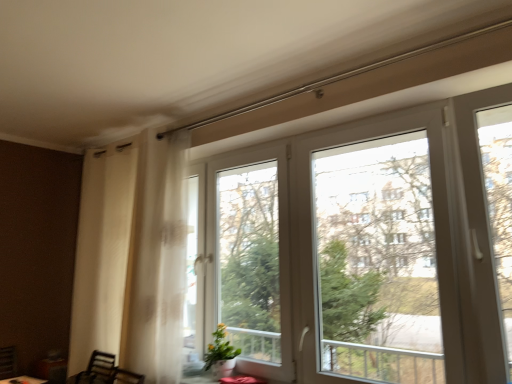
Question: Does transparent glass window at center, which is the second window screen in right-to-left order, appear on the left side of yellow-green leafy plant at lower center?

Choices:
 (A) yes
 (B) no

Answer: (B)

Question: Would you say yellow-green leafy plant at lower center is part of transparent glass window at center, which is the second window screen in right-to-left order,'s contents?

Choices:
 (A) no
 (B) yes

Answer: (B)

Question: From a real-world perspective, does transparent glass window at center, the 1th window screen viewed from the left, stand above yellow-green leafy plant at lower center?

Choices:
 (A) no
 (B) yes

Answer: (B)

Question: Can you confirm if transparent glass window at center, which is the second window screen in right-to-left order, is wider than yellow-green leafy plant at lower center?

Choices:
 (A) no
 (B) yes

Answer: (A)

Question: Is transparent glass window at center, the 1th window screen viewed from the left, located outside yellow-green leafy plant at lower center?

Choices:
 (A) yes
 (B) no

Answer: (A)

Question: In the image, is yellow-green leafy plant at lower center on the left side or the right side of matte red table at lower center?

Choices:
 (A) left
 (B) right

Answer: (A)

Question: Considering their positions, is yellow-green leafy plant at lower center located in front of or behind matte red table at lower center?

Choices:
 (A) front
 (B) behind

Answer: (B)

Question: Based on their sizes in the image, would you say yellow-green leafy plant at lower center is bigger or smaller than matte red table at lower center?

Choices:
 (A) big
 (B) small

Answer: (A)

Question: Is yellow-green leafy plant at lower center taller or shorter than matte red table at lower center?

Choices:
 (A) tall
 (B) short

Answer: (A)

Question: Is yellow-green leafy plant at lower center bigger or smaller than transparent glass window at center, the 1th window screen viewed from the left?

Choices:
 (A) small
 (B) big

Answer: (A)

Question: Looking at their shapes, would you say yellow-green leafy plant at lower center is wider or thinner than transparent glass window at center, which is the second window screen in right-to-left order?

Choices:
 (A) wide
 (B) thin

Answer: (A)

Question: From a real-world perspective, is yellow-green leafy plant at lower center positioned above or below transparent glass window at center, the 1th window screen viewed from the left?

Choices:
 (A) above
 (B) below

Answer: (B)

Question: From the image's perspective, is yellow-green leafy plant at lower center positioned above or below transparent glass window at center, which is the second window screen in right-to-left order?

Choices:
 (A) above
 (B) below

Answer: (B)

Question: Is transparent glass window at center, the 1th window screen viewed from the left, situated inside yellow-green leafy plant at lower center or outside?

Choices:
 (A) outside
 (B) inside

Answer: (A)

Question: From the image's perspective, relative to yellow-green leafy plant at lower center, is transparent glass window at center, which is the second window screen in right-to-left order, above or below?

Choices:
 (A) above
 (B) below

Answer: (A)